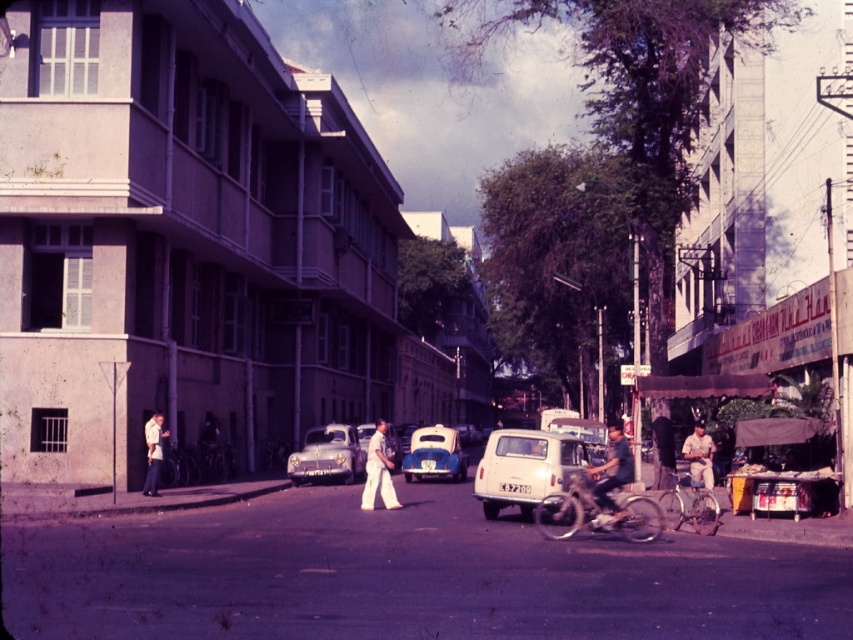
Question: Which is farther from the white cotton shirt at left?

Choices:
 (A) matte gray car at center
 (B) white cotton pants at center
 (C) light brown leather jacket at lower right

Answer: (C)

Question: Among these objects, which one is farthest from the camera?

Choices:
 (A) white matte van at center
 (B) matte black bicycle at center
 (C) matte gray car at center

Answer: (C)

Question: In this image, where is matte gray car at center located relative to white cotton pants at center?

Choices:
 (A) right
 (B) left

Answer: (B)

Question: Does white matte van at center have a larger size compared to matte gray car at center?

Choices:
 (A) no
 (B) yes

Answer: (B)

Question: Is white matte van at center further to camera compared to blue matte car at center?

Choices:
 (A) yes
 (B) no

Answer: (B)

Question: Which point appears closest to the camera in this image?

Choices:
 (A) (390, 465)
 (B) (561, 452)

Answer: (B)